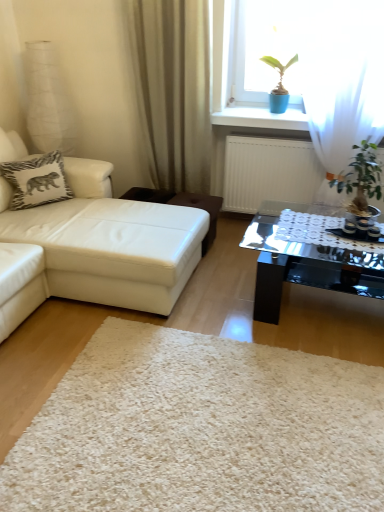
What do you see at coordinates (201, 429) in the screenshot? I see `white shaggy rug at center` at bounding box center [201, 429].

This screenshot has width=384, height=512. What do you see at coordinates (305, 263) in the screenshot?
I see `transparent glass coffee table at center` at bounding box center [305, 263].

Identify the location of green leafy plant at right. The height and width of the screenshot is (512, 384). (361, 180).

Is green leafy plant at right thinner than white shaggy rug at center?

Correct, the width of green leafy plant at right is less than that of white shaggy rug at center.

Could you tell me if green leafy plant at right is facing white shaggy rug at center?

Yes.

Does green leafy plant at right touch white shaggy rug at center?

green leafy plant at right and white shaggy rug at center are not in contact.

Considering the relative positions of green leafy plant at right and white shaggy rug at center in the image provided, is green leafy plant at right in front of white shaggy rug at center?

No.

Does white shaggy rug at center turn towards white zebra-patterned pillow at upper left?

No, white shaggy rug at center does not turn towards white zebra-patterned pillow at upper left.

In terms of size, does white shaggy rug at center appear bigger or smaller than white zebra-patterned pillow at upper left?

Considering their sizes, white shaggy rug at center takes up more space than white zebra-patterned pillow at upper left.

From the image's perspective, is white shaggy rug at center located above or below white zebra-patterned pillow at upper left?

white shaggy rug at center is situated lower than white zebra-patterned pillow at upper left in the image.

Locate an element on the screen. The image size is (384, 512). pillow that appears above the white shaggy rug at center (from the image's perspective) is located at coordinates (37, 180).

Identify the location of curtain located above the white leather studio couch at left (from a real-world perspective). Image resolution: width=384 pixels, height=512 pixels. (172, 89).

Consider the image. Is white leather studio couch at left completely or partially outside of beige fabric curtain at upper center?

That's correct, white leather studio couch at left is outside of beige fabric curtain at upper center.

From the image's perspective, is white leather studio couch at left over beige fabric curtain at upper center?

Actually, white leather studio couch at left appears below beige fabric curtain at upper center in the image.

Is brown leather stool at center further to the viewer compared to white shaggy rug at center?

Yes, it is behind white shaggy rug at center.

Is brown leather stool at center not inside white shaggy rug at center?

Yes, brown leather stool at center is located beyond the bounds of white shaggy rug at center.

In terms of size, does brown leather stool at center appear bigger or smaller than white shaggy rug at center?

Clearly, brown leather stool at center is smaller in size than white shaggy rug at center.

In order to click on stool behind the transparent glass coffee table at center in this screenshot , I will do `click(203, 209)`.

Who is more distant, brown leather stool at center or transparent glass coffee table at center?

brown leather stool at center.

Is point (210, 220) farther from viewer compared to point (351, 279)?

Yes.

Between brown leather stool at center and transparent glass coffee table at center, which one has larger width?

With larger width is transparent glass coffee table at center.

Would you say white shaggy rug at center is a long distance from white leather studio couch at left?

No, white shaggy rug at center is not far from white leather studio couch at left.

Is white leather studio couch at left at the back of white shaggy rug at center?

No, white shaggy rug at center is not facing away from white leather studio couch at left.

This screenshot has height=512, width=384. Identify the location of studio couch positioned vertically above the white shaggy rug at center (from a real-world perspective). (95, 248).

From a real-world perspective, does beige fabric curtain at upper center sit lower than transparent glass coffee table at center?

No, from a real-world perspective, beige fabric curtain at upper center is not below transparent glass coffee table at center.

In the image, is beige fabric curtain at upper center positioned in front of or behind transparent glass coffee table at center?

beige fabric curtain at upper center is behind transparent glass coffee table at center.

From their relative heights in the image, would you say beige fabric curtain at upper center is taller or shorter than transparent glass coffee table at center?

Clearly, beige fabric curtain at upper center is taller compared to transparent glass coffee table at center.

Which is behind, point (189, 133) or point (277, 293)?

Positioned behind is point (189, 133).

What are the coordinates of `plain lying on the left of green leafy plant at right` in the screenshot? It's located at (201, 429).

The image size is (384, 512). There is a white shaggy rug at center. Identify the location of pillow above it (from a real-world perspective). (37, 180).

From the image, which object appears to be farther from white leather studio couch at left, transparent glass coffee table at center or white shaggy rug at center?

transparent glass coffee table at center is positioned further to the anchor white leather studio couch at left.

Based on their spatial positions, is transparent glass coffee table at center or beige fabric curtain at upper center closer to white shaggy rug at center?

transparent glass coffee table at center is closer to white shaggy rug at center.

Considering their positions, is white zebra-patterned pillow at upper left positioned closer to white leather studio couch at left than brown leather stool at center?

white zebra-patterned pillow at upper left is positioned closer to the anchor white leather studio couch at left.

Based on their spatial positions, is brown leather stool at center or beige fabric curtain at upper center closer to transparent glass coffee table at center?

brown leather stool at center is positioned closer to the anchor transparent glass coffee table at center.

Based on their spatial positions, is white zebra-patterned pillow at upper left or white leather studio couch at left closer to brown leather stool at center?

white leather studio couch at left.

Which object lies further to the anchor point white leather studio couch at left, beige fabric curtain at upper center or white zebra-patterned pillow at upper left?

Based on the image, beige fabric curtain at upper center appears to be further to white leather studio couch at left.

Looking at the image, which one is located closer to transparent glass coffee table at center, white leather studio couch at left or white shaggy rug at center?

The object closer to transparent glass coffee table at center is white shaggy rug at center.

Based on their spatial positions, is green leafy plant at right or brown leather stool at center closer to white shaggy rug at center?

Among the two, green leafy plant at right is located nearer to white shaggy rug at center.

The width and height of the screenshot is (384, 512). I want to click on houseplant between transparent glass coffee table at center and brown leather stool at center along the z-axis, so click(x=361, y=180).

Find the location of a particular element. The height and width of the screenshot is (512, 384). houseplant located between white shaggy rug at center and brown leather stool at center in the depth direction is located at coordinates (361, 180).

This screenshot has width=384, height=512. Find the location of `studio couch that lies between beige fabric curtain at upper center and white shaggy rug at center from top to bottom`. studio couch that lies between beige fabric curtain at upper center and white shaggy rug at center from top to bottom is located at coordinates (95, 248).

At what (x,y) coordinates should I click in order to perform the action: click on pillow between beige fabric curtain at upper center and white shaggy rug at center in the vertical direction. Please return your answer as a coordinate pair (x, y). Looking at the image, I should click on tap(37, 180).